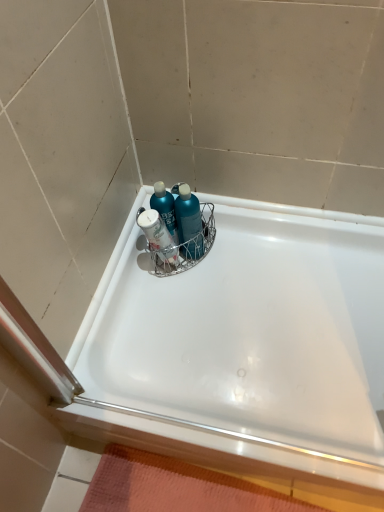
The image size is (384, 512). Identify the location of free space to the right of teal glossy shampoo at center, which is the first cleaning product from left to right. (236, 246).